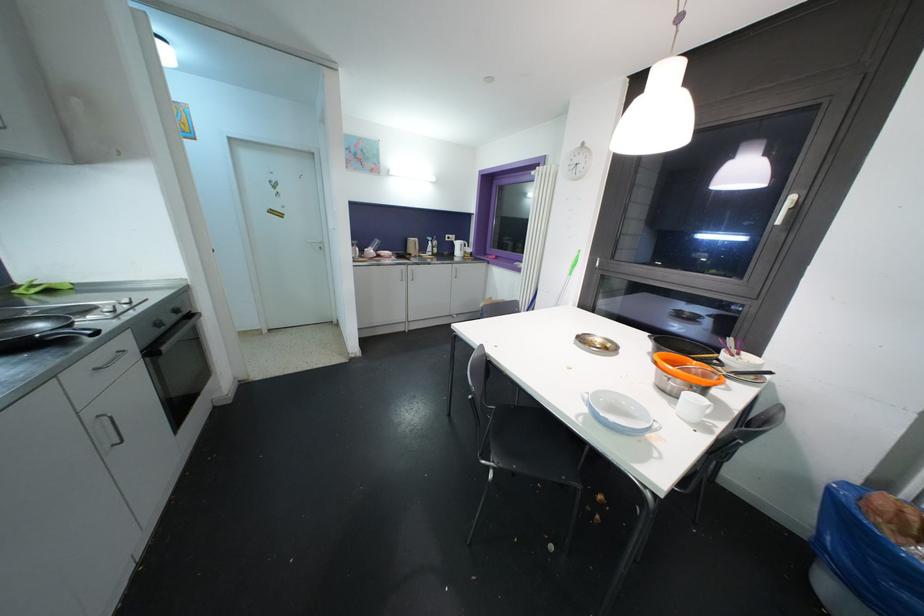
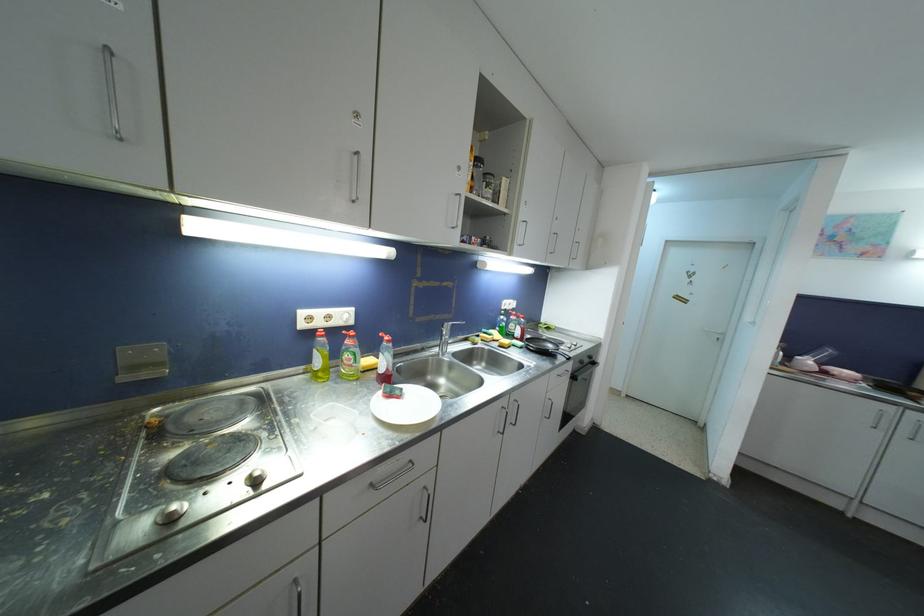
Question: The camera is either moving clockwise (left) or counter-clockwise (right) around the object. The first image is from the beginning of the video and the second image is from the end. Is the camera moving left or right when shooting the video?

Choices:
 (A) Left
 (B) Right

Answer: (B)